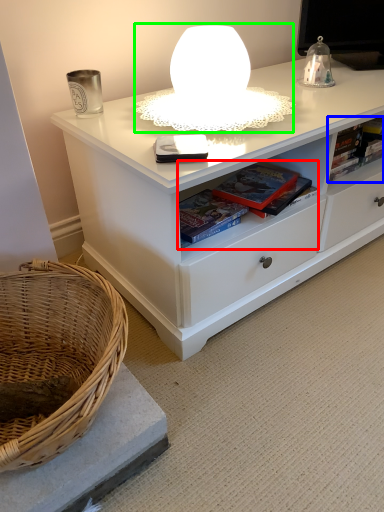
Question: Based on their relative distances, which object is farther from book (highlighted by a red box)? Choose from book (highlighted by a blue box) and table lamp (highlighted by a green box).

Choices:
 (A) book
 (B) table lamp

Answer: (A)